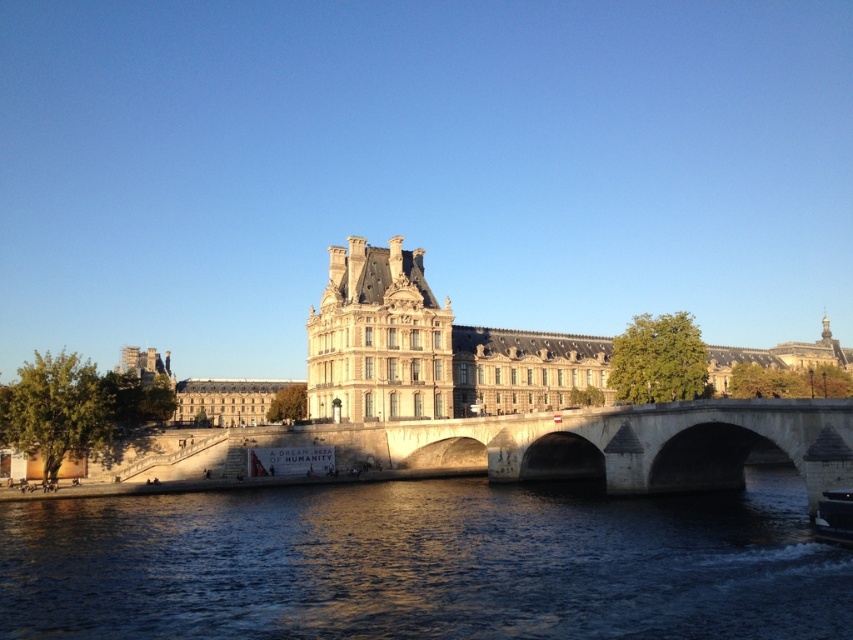
Does dark blue water at center appear over beige stone palace at center?

No, dark blue water at center is not above beige stone palace at center.

Who is positioned more to the right, dark blue water at center or beige stone palace at center?

From the viewer's perspective, beige stone palace at center appears more on the right side.

Locate an element on the screen. dark blue water at center is located at coordinates (424, 563).

Locate an element on the screen. Image resolution: width=853 pixels, height=640 pixels. dark blue water at center is located at coordinates (424, 563).